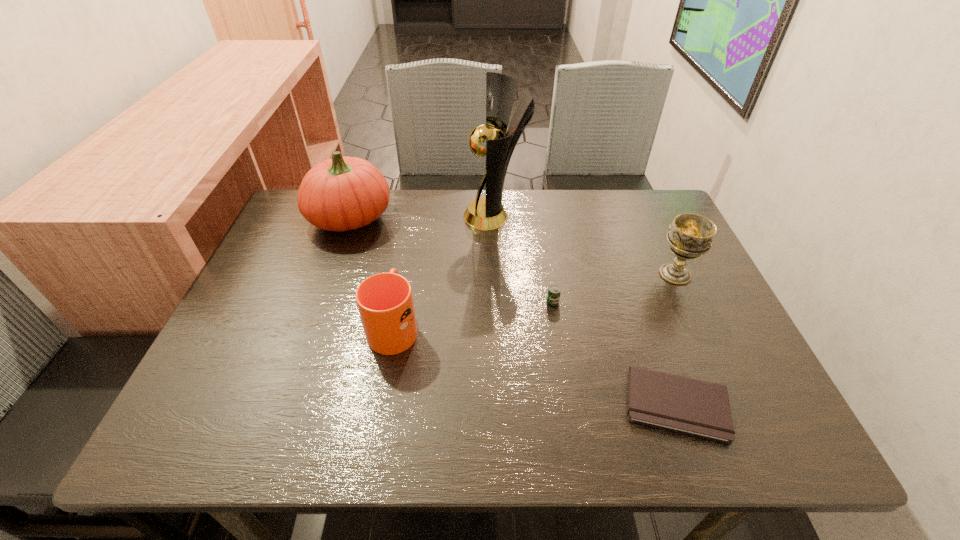
The height and width of the screenshot is (540, 960). What are the coordinates of `award` in the screenshot? It's located at [487, 213].

Image resolution: width=960 pixels, height=540 pixels. Find the location of `the leftmost object`. the leftmost object is located at coordinates (345, 193).

Image resolution: width=960 pixels, height=540 pixels. In order to click on pumpkin in this screenshot , I will do `click(345, 193)`.

Locate an element on the screen. The image size is (960, 540). the fourth nearest object is located at coordinates (690, 235).

Identify the location of the fifth object from right to left. (385, 303).

The height and width of the screenshot is (540, 960). Find the location of `the second shortest object`. the second shortest object is located at coordinates (554, 291).

Where is `the nearest object`? the nearest object is located at coordinates (698, 408).

I want to click on checkbook, so click(x=698, y=408).

What are the coordinates of `free space located 0.250m at the front of the tallest object, where the globe is visible` in the screenshot? It's located at (377, 216).

Find the location of `blank area located 0.290m at the front of the tallest object, where the globe is visible`. blank area located 0.290m at the front of the tallest object, where the globe is visible is located at coordinates (364, 216).